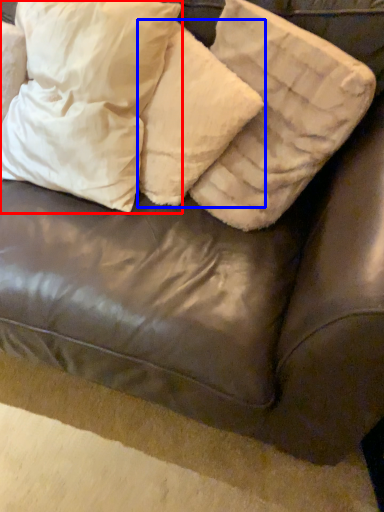
Question: Which object appears closest to the camera in this image, pillow (highlighted by a red box) or pillow (highlighted by a blue box)?

Choices:
 (A) pillow
 (B) pillow

Answer: (A)